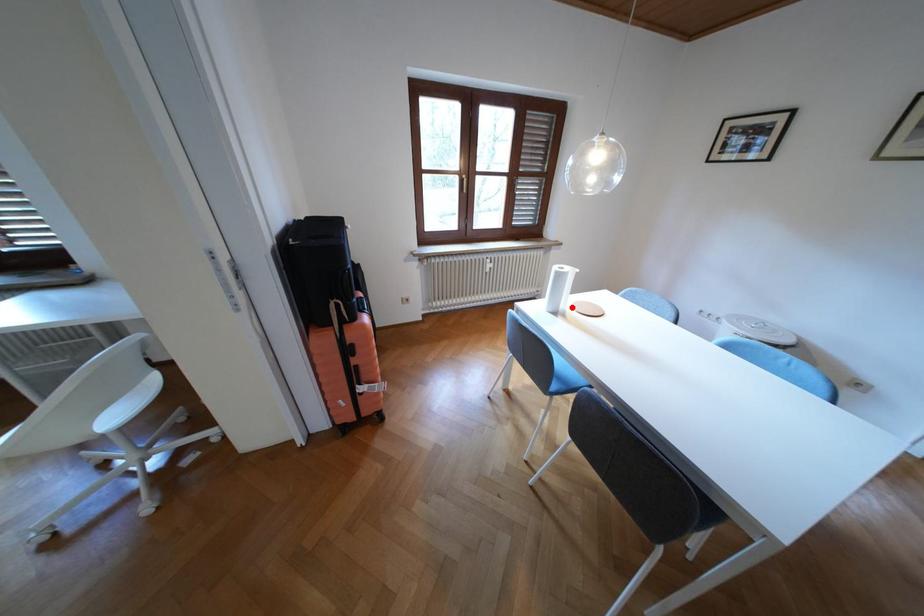
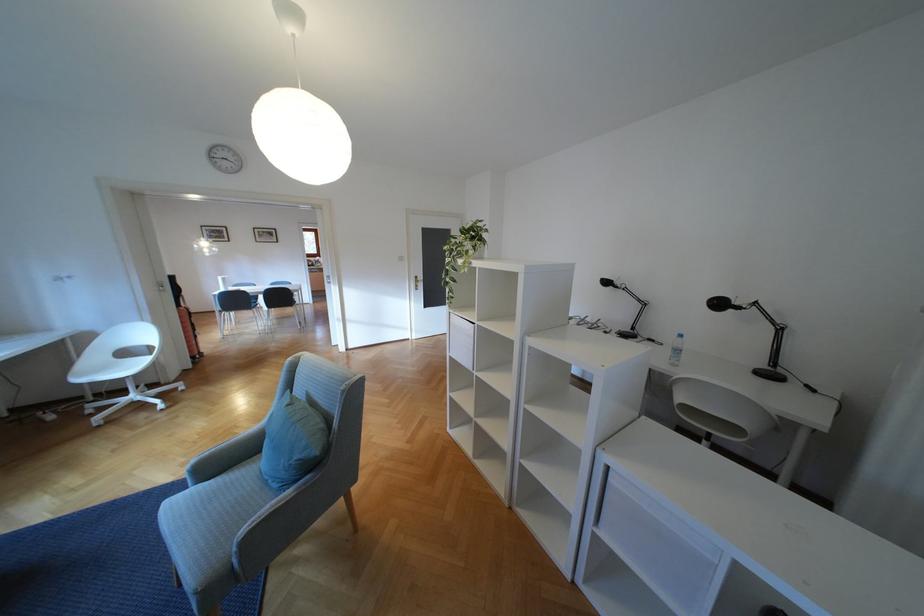
Question: I am providing you with two images of the same scene from different viewpoints. A red point is marked on the first image. Is the red point's position out of view in image 2?

Choices:
 (A) Yes
 (B) No

Answer: (A)